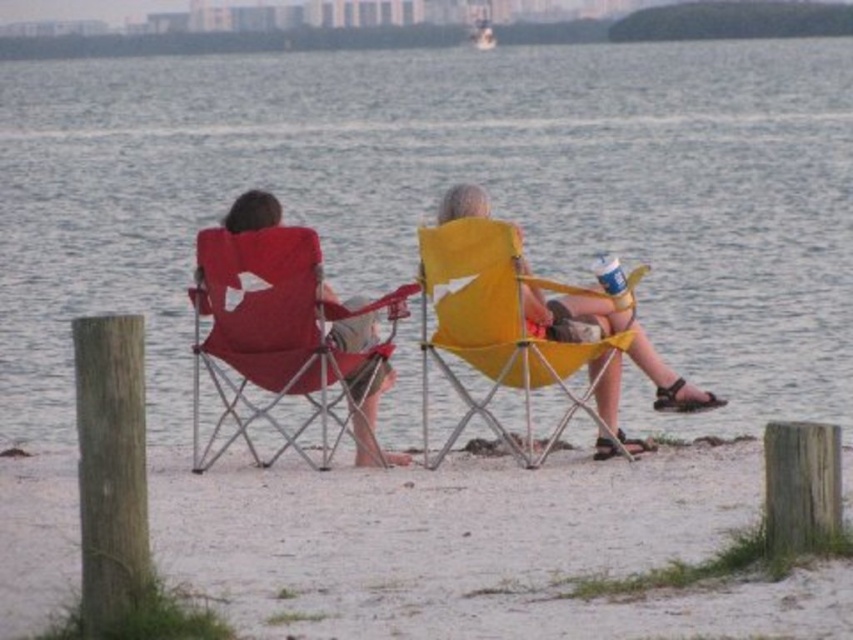
Question: Which point is farther to the camera?

Choices:
 (A) (793, 396)
 (B) (520, 243)
 (C) (550, 435)
 (D) (236, 424)

Answer: (A)

Question: Is matte red chair at center positioned in front of yellow fabric beach chair at center?

Choices:
 (A) yes
 (B) no

Answer: (B)

Question: Which point is farther to the camera?

Choices:
 (A) (426, 230)
 (B) (291, 627)

Answer: (A)

Question: Can you confirm if matte red chair at center is wider than yellow fabric beach chair at center?

Choices:
 (A) yes
 (B) no

Answer: (A)

Question: From the image, what is the correct spatial relationship of blue water at center in relation to matte red beach chair at left?

Choices:
 (A) right
 (B) left

Answer: (A)

Question: Estimate the real-world distances between objects in this image. Which object is closer to the matte red beach chair at left?

Choices:
 (A) white sand at center
 (B) blue water at center

Answer: (A)